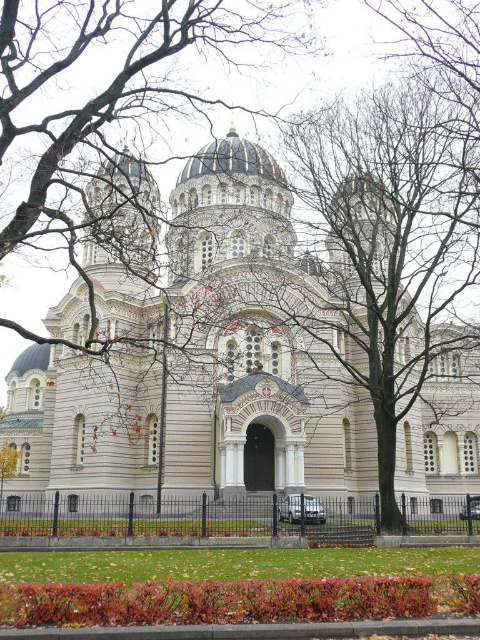
You are standing at the entrance of the cathedral and want to take a photo of the white stone church at center. In which direction should you move to frame it properly?

The white stone church at center is located at point coordinates, so you should move to the center of the image to frame it properly.

You are standing in front of the cathedral and want to take a photo that includes both the white stone church at center and the green grass at lower center. Which object should you focus on first to ensure both are in frame?

The white stone church at center is larger in size than the green grass at lower center, so you should focus on the white stone church at center first to ensure both are in frame.